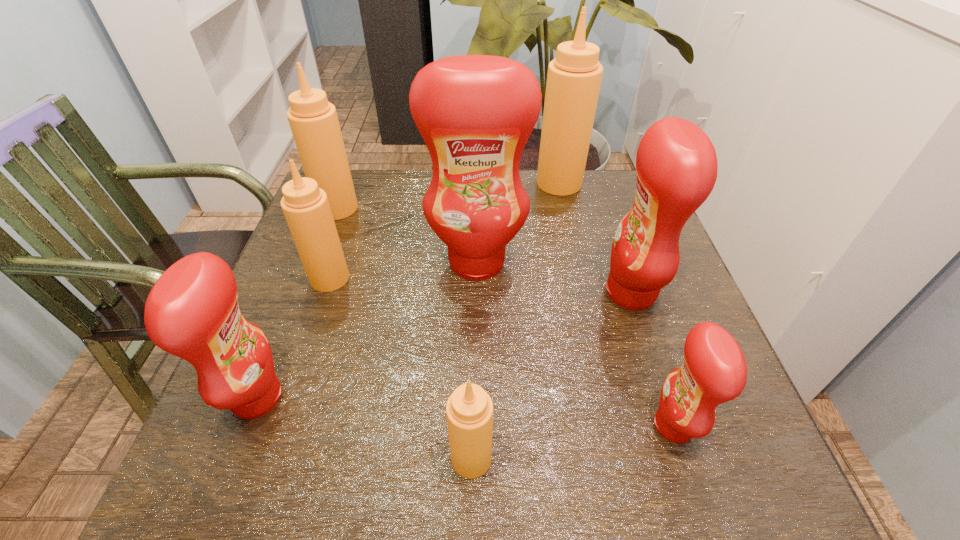
Locate an element on the screen. the smallest red condiment is located at coordinates (714, 371).

You are a GUI agent. You are given a task and a screenshot of the screen. Output one action in this format:
    pyautogui.click(x=<x>, y=<y>)
    Task: Click on the vacant region located 0.340m on the front of the farthest tan condiment
    The image size is (960, 540).
    Given the screenshot: What is the action you would take?
    pyautogui.click(x=582, y=284)

Image resolution: width=960 pixels, height=540 pixels. I want to click on vacant region located on the label side of the biggest red condiment, so click(475, 397).

The width and height of the screenshot is (960, 540). I want to click on vacant region located on the right of the seventh nearest condiment, so click(499, 208).

Locate an element on the screen. The height and width of the screenshot is (540, 960). vacant space located on the label side of the third smallest red condiment is located at coordinates (563, 293).

Locate an element on the screen. The height and width of the screenshot is (540, 960). vacant space located on the label side of the third smallest red condiment is located at coordinates (516, 293).

The height and width of the screenshot is (540, 960). Identify the location of vacant space located on the label side of the third smallest red condiment. (516, 293).

The image size is (960, 540). Identify the location of vacant region located 0.230m on the right of the second nearest tan condiment. point(451,279).

At what (x,y) coordinates should I click in order to perform the action: click on free region located on the label side of the third biggest red condiment. Please return your answer as a coordinate pair (x, y). Looking at the image, I should click on (442, 397).

At what (x,y) coordinates should I click in order to perform the action: click on vacant space located 0.230m on the right of the smallest tan condiment. Please return your answer as a coordinate pair (x, y). The width and height of the screenshot is (960, 540). Looking at the image, I should click on (635, 458).